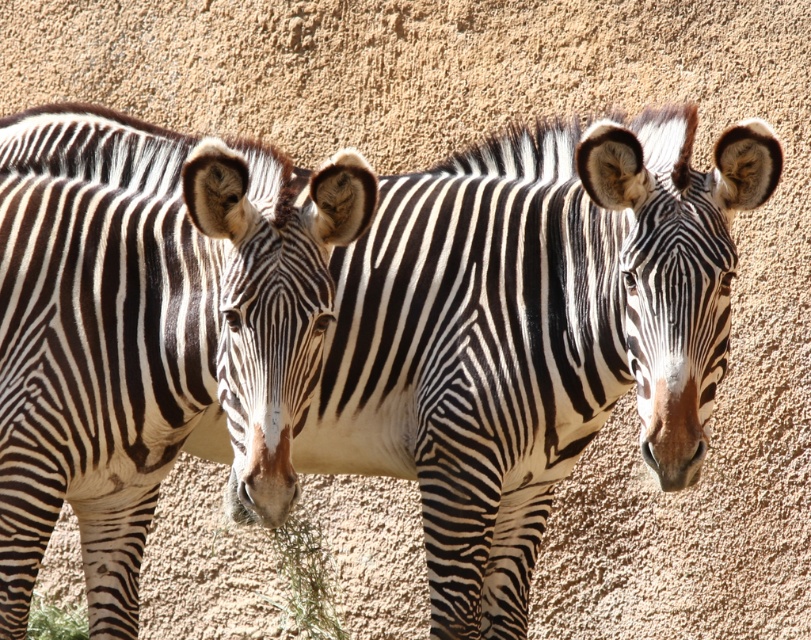
You are an animal trainer observing two zebras in an enclosure. You notice a specific point at coordinates (x=149, y=330). Which zebra does this point correspond to?

The point at coordinates (x=149, y=330) corresponds to the black and white striped zebra at left.

You are a wildlife photographer standing at the camera position. You want to take a closeup photo of the black and white striped zebra at left. Given that your camera can focus on subjects within 2 meters, will you be able to take the photo without moving closer?

The black and white striped zebra at left is 3.07 meters away from the camera, which is beyond the camera focus range of 2 meters. Therefore, you cannot take the closeup photo without moving closer.

Based on the photo, you are a photographer trying to capture a photo of the black and white striped zebra at left and the green leafy grass at lower center. You want to ensure both are in the frame. Based on their positions, which object should you focus on first to include both in your shot?

The black and white striped zebra at left is to the left of the green leafy grass at lower center, so you should focus on the black and white striped zebra at left first to ensure both are in the frame.